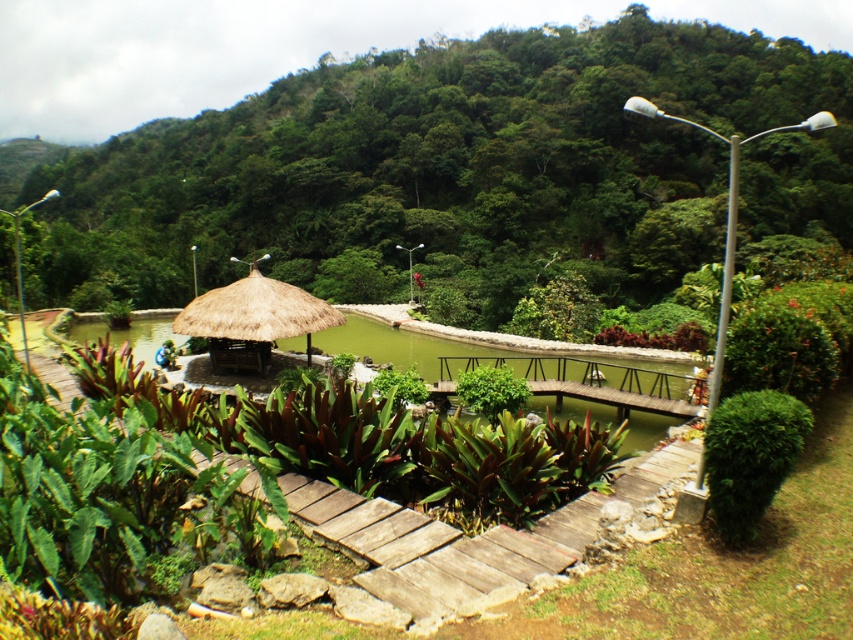
Question: Which point is closer to the camera taking this photo?

Choices:
 (A) (250, 352)
 (B) (637, 356)
 (C) (451, 394)
 (D) (358, 200)

Answer: (C)

Question: Can you confirm if green grassy water at center is positioned to the right of thatched straw umbrella at center?

Choices:
 (A) no
 (B) yes

Answer: (A)

Question: Is green leafy plants at center smaller than green grassy water at center?

Choices:
 (A) yes
 (B) no

Answer: (B)

Question: Which object is farther from the camera taking this photo?

Choices:
 (A) wooden bridge at center
 (B) green leafy plants at center

Answer: (B)

Question: Among these objects, which one is nearest to the camera?

Choices:
 (A) green grassy water at center
 (B) green leafy plants at center

Answer: (A)

Question: Is green leafy plants at center positioned at the back of wooden bridge at center?

Choices:
 (A) no
 (B) yes

Answer: (B)